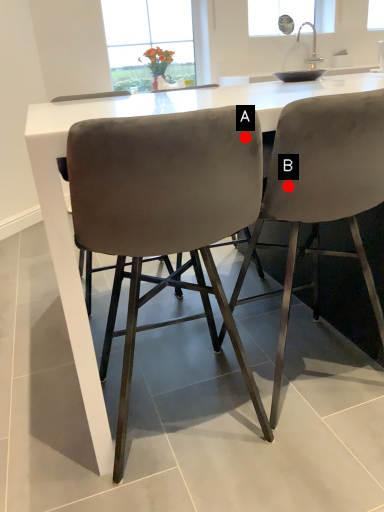
Question: Two points are circled on the image, labeled by A and B beside each circle. Which point is closer to the camera?

Choices:
 (A) A is closer
 (B) B is closer

Answer: (A)